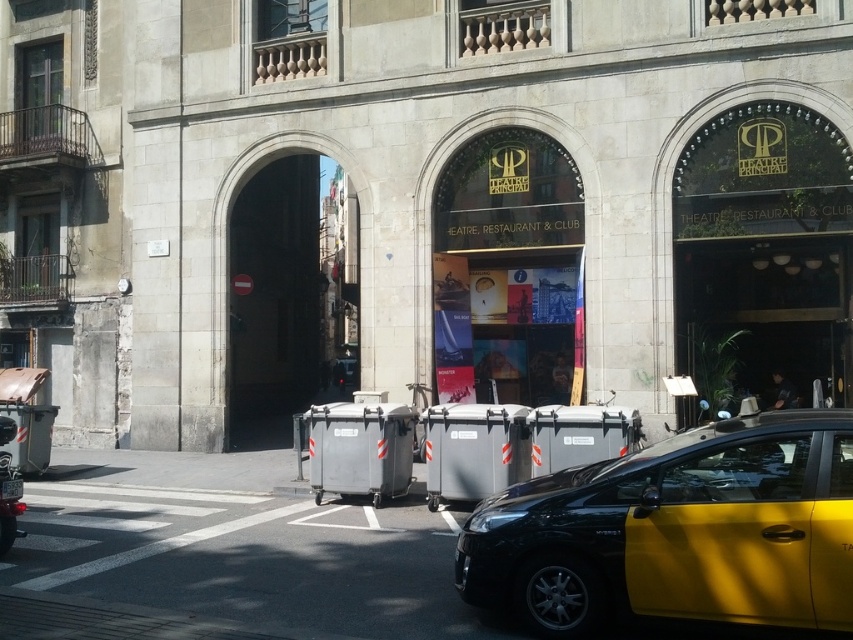
You are standing at the center of the image. Which object is closer to the bottom edge of the image, the shiny chrome motorcycle at lower left or the black and yellow taxi on the right side?

The shiny chrome motorcycle at lower left is closer to the bottom edge of the image because its 2D location is at point 0.011 on the y axis, which is closer to the bottom edge compared to the taxi.

You are a delivery person who needs to park your vehicle between the shiny chrome motorcycle at lower left and the white plastic license plate at lower center. Since you have a bicycle that is 1.2 meters tall, will it fit vertically between them?

The shiny chrome motorcycle at lower left is taller than the white plastic license plate at lower center. Since the bicycle is 1.2 meters tall, it may not fit if the space between them is less than 1.2 meters in height. However, without knowing the exact height difference between the motorcycle and the license plate, it is impossible to determine if the bicycle will fit vertically.